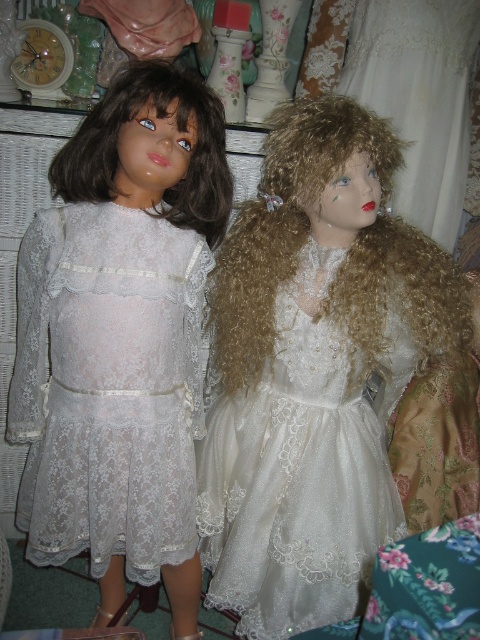
Is lace fabric dress at left wider than white satin dress at center?

In fact, lace fabric dress at left might be narrower than white satin dress at center.

Consider the image. Does lace fabric dress at left come behind white satin dress at center?

No, lace fabric dress at left is in front of white satin dress at center.

The width and height of the screenshot is (480, 640). What do you see at coordinates (108, 387) in the screenshot? I see `lace fabric dress at left` at bounding box center [108, 387].

Identify the location of lace fabric dress at left. (108, 387).